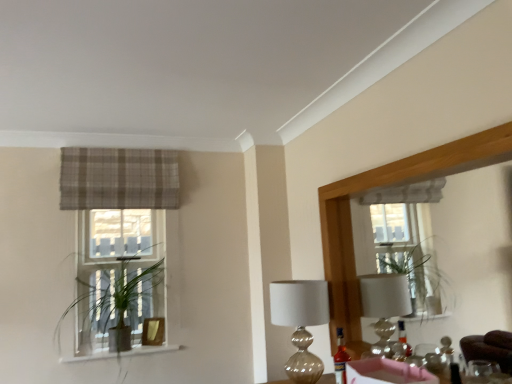
Question: From the image's perspective, is metallic glass table lamp at center positioned above or below plaid fabric curtain at upper left?

Choices:
 (A) below
 (B) above

Answer: (A)

Question: Considering the positions of metallic glass table lamp at center and plaid fabric curtain at upper left in the image, is metallic glass table lamp at center wider or thinner than plaid fabric curtain at upper left?

Choices:
 (A) wide
 (B) thin

Answer: (A)

Question: Which object is positioned farthest from the green leafy plant at left?

Choices:
 (A) plaid fabric curtain at upper left
 (B) matte wood window sill at lower left
 (C) translucent glass bottle at center
 (D) metallic glass table lamp at center
 (E) wooden mirror at upper right

Answer: (C)

Question: Estimate the real-world distances between objects in this image. Which object is closer to the metallic glass table lamp at center?

Choices:
 (A) green leafy plant at left
 (B) matte wood window sill at lower left
 (C) translucent glass bottle at center
 (D) plaid fabric curtain at upper left
 (E) wooden mirror at upper right

Answer: (C)